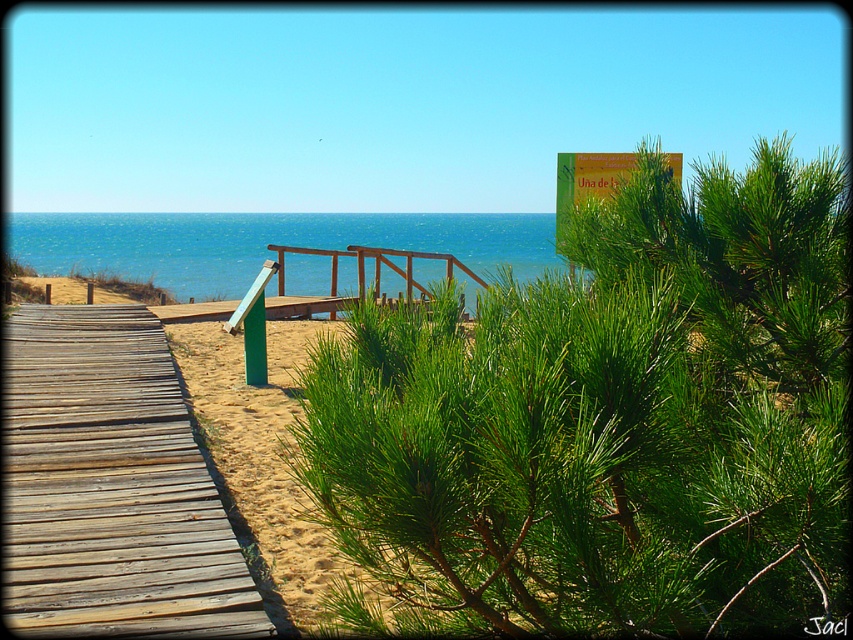
The height and width of the screenshot is (640, 853). What do you see at coordinates (607, 424) in the screenshot? I see `green needle-like at center` at bounding box center [607, 424].

Who is positioned more to the left, green needle-like at center or sandy yellow at lower left?

Positioned to the left is sandy yellow at lower left.

Between point (527, 483) and point (253, 518), which one is positioned in front?

Point (527, 483) is more forward.

The width and height of the screenshot is (853, 640). I want to click on green needle-like at center, so click(607, 424).

Does blue water at center have a smaller size compared to wooden rail at center?

Actually, blue water at center might be larger than wooden rail at center.

Between blue water at center and wooden rail at center, which one is positioned higher?

blue water at center is above.

You are a GUI agent. You are given a task and a screenshot of the screen. Output one action in this format:
    pyautogui.click(x=<x>, y=<y>)
    Task: Click on the blue water at center
    
    Given the screenshot: What is the action you would take?
    pyautogui.click(x=265, y=243)

This screenshot has height=640, width=853. I want to click on blue water at center, so click(265, 243).

Based on the photo, who is higher up, blue water at center or yellow paper sign at upper center?

blue water at center is higher up.

From the picture: Can you confirm if blue water at center is positioned to the left of yellow paper sign at upper center?

Correct, you'll find blue water at center to the left of yellow paper sign at upper center.

Is point (410, 234) positioned behind point (572, 170)?

Yes.

Identify the location of blue water at center. (265, 243).